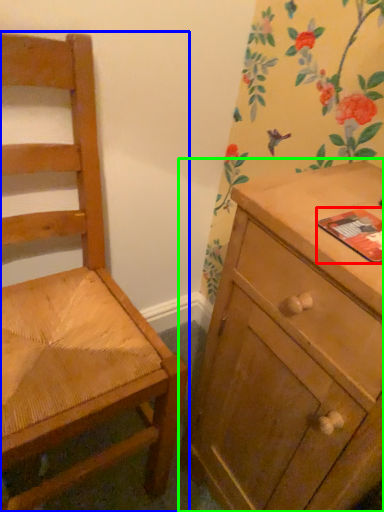
Question: Which object is positioned farthest from paperback book (highlighted by a red box)? Select from chair (highlighted by a blue box) and chest of drawers (highlighted by a green box).

Choices:
 (A) chair
 (B) chest of drawers

Answer: (A)